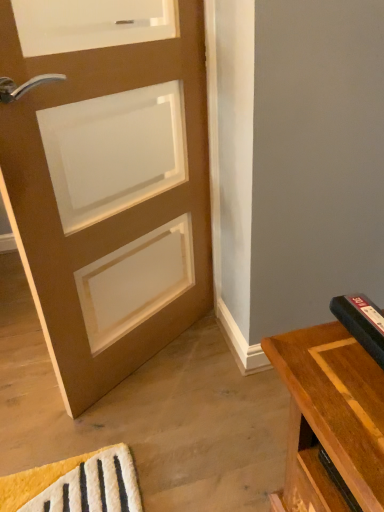
This screenshot has height=512, width=384. Find the location of `free space to the left of matte brown door at left`. free space to the left of matte brown door at left is located at coordinates (x=23, y=371).